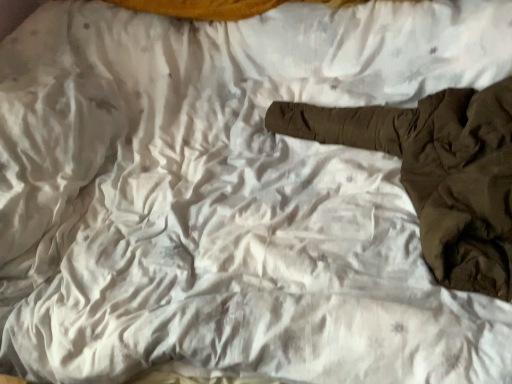
This screenshot has height=384, width=512. I want to click on dark brown fabric at center, so click(437, 173).

Describe the element at coordinates (437, 173) in the screenshot. I see `dark brown fabric at center` at that location.

At what (x,y) coordinates should I click in order to perform the action: click on dark brown fabric at center. Please return your answer as a coordinate pair (x, y). The height and width of the screenshot is (384, 512). Looking at the image, I should click on (437, 173).